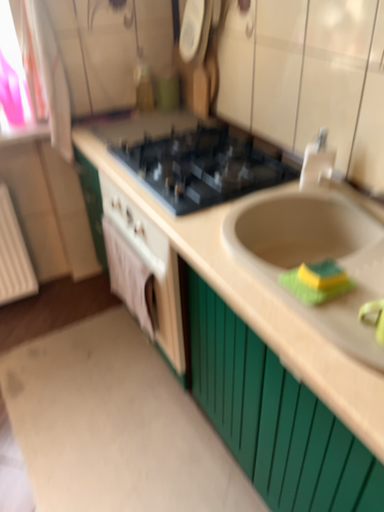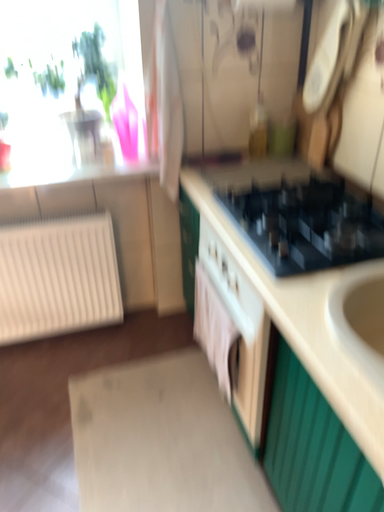
Question: Which way did the camera rotate in the video?

Choices:
 (A) rotated left
 (B) rotated right

Answer: (A)